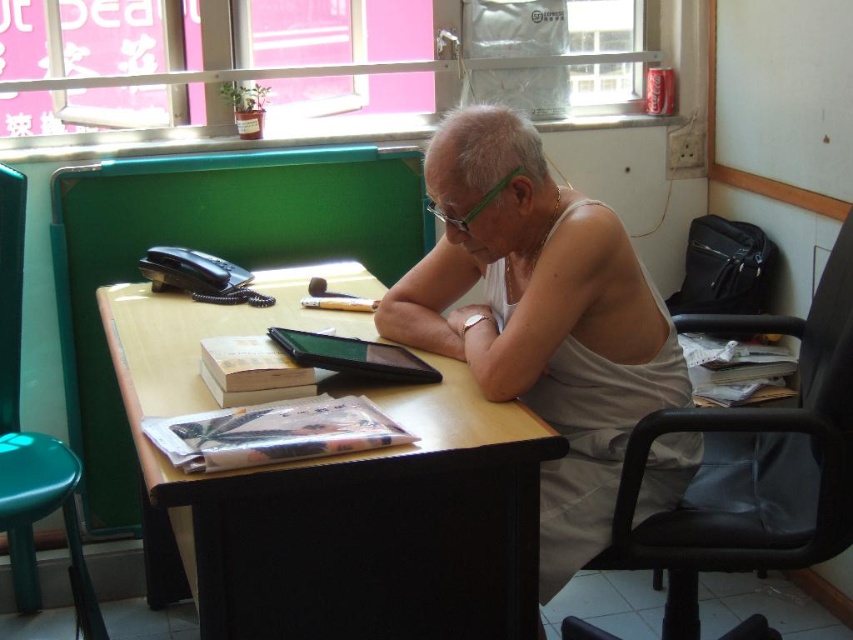
Which is above, white cotton tank top at center or matte paper book at center?

white cotton tank top at center

The image size is (853, 640). Describe the element at coordinates (541, 320) in the screenshot. I see `white cotton tank top at center` at that location.

You are a GUI agent. You are given a task and a screenshot of the screen. Output one action in this format:
    pyautogui.click(x=<x>, y=<y>)
    Task: Click on the white cotton tank top at center
    
    Given the screenshot: What is the action you would take?
    pyautogui.click(x=541, y=320)

Between wooden table at center and matte paper book at center, which one appears on the right side from the viewer's perspective?

matte paper book at center is more to the right.

Which is below, wooden table at center or matte paper book at center?

Positioned lower is matte paper book at center.

Is point (352, 637) positioned after point (157, 445)?

Yes, point (352, 637) is farther from viewer.

Where is `wooden table at center`? wooden table at center is located at coordinates (338, 490).

Which is behind, point (722, 552) or point (276, 406)?

The point (722, 552) is behind.

Measure the distance between black leather chair at right and camera.

black leather chair at right is 1.32 meters away from camera.

Is point (675, 628) positioned behind point (210, 420)?

Yes, point (675, 628) is behind point (210, 420).

Locate an element on the screen. The width and height of the screenshot is (853, 640). black leather chair at right is located at coordinates (753, 461).